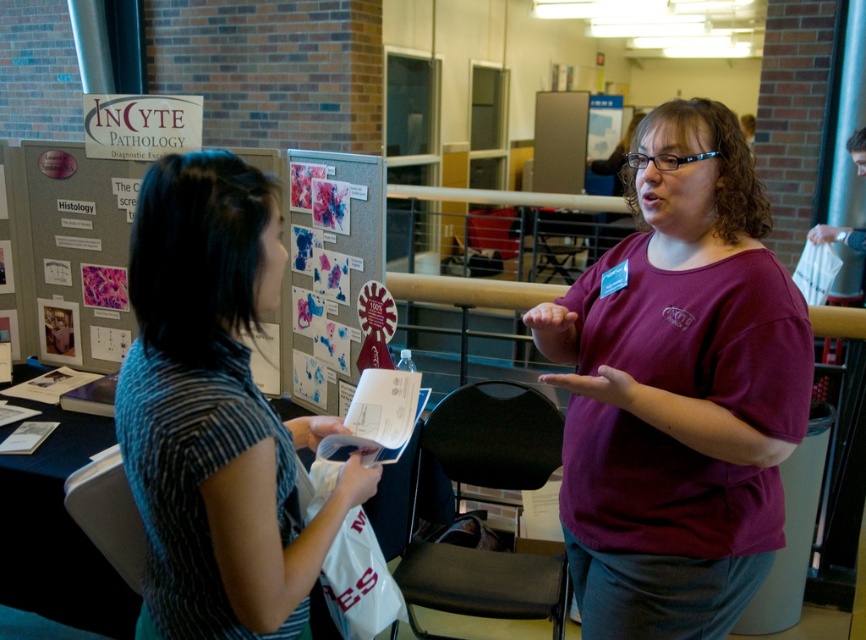
Between maroon t-shirt at center and watercolor paper poster at center, which one appears on the left side from the viewer's perspective?

From the viewer's perspective, watercolor paper poster at center appears more on the left side.

Does point (779, 476) come behind point (296, 230)?

No.

Who is more forward, (725, 404) or (366, 186)?

Point (725, 404) is more forward.

In order to click on maroon t-shirt at center in this screenshot , I will do pyautogui.click(x=677, y=390).

Who is positioned more to the right, maroon t-shirt at center or matte gray bulletin board at center?

maroon t-shirt at center

Can you confirm if maroon t-shirt at center is wider than matte gray bulletin board at center?

No.

This screenshot has height=640, width=866. I want to click on maroon t-shirt at center, so click(677, 390).

Consider the image. Between maroon t-shirt at center and striped fabric shirt at center, which one has more height?

With more height is maroon t-shirt at center.

The width and height of the screenshot is (866, 640). What do you see at coordinates (677, 390) in the screenshot?
I see `maroon t-shirt at center` at bounding box center [677, 390].

At what (x,y) coordinates should I click in order to perform the action: click on maroon t-shirt at center. Please return your answer as a coordinate pair (x, y). The height and width of the screenshot is (640, 866). Looking at the image, I should click on (677, 390).